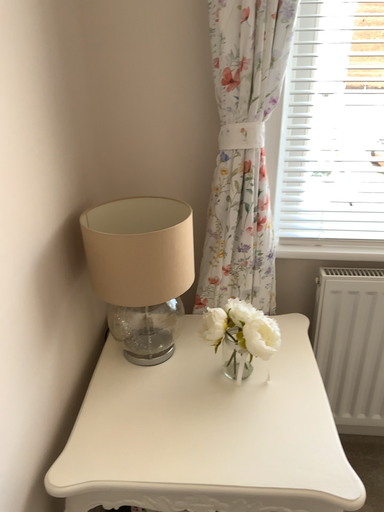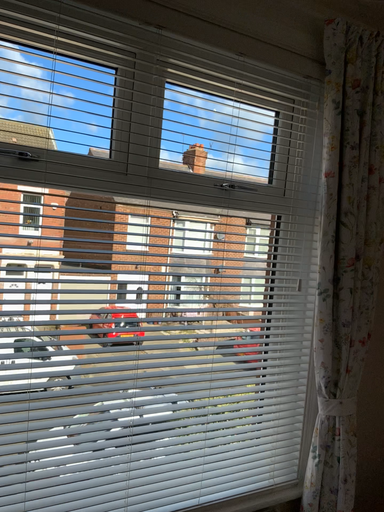
Question: How did the camera likely rotate when shooting the video?

Choices:
 (A) rotated right
 (B) rotated left

Answer: (A)